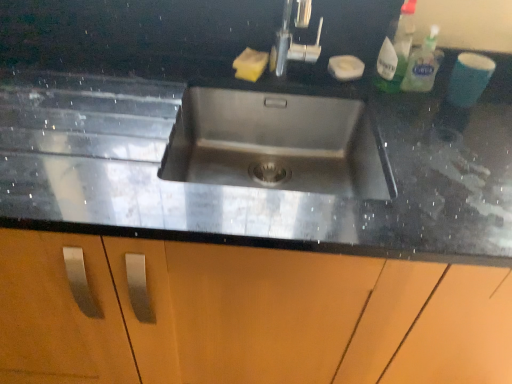
Question: Considering the relative sizes of yellow sponge at upper center, acting as the second soap starting from the right, and translucent plastic spray bottle at upper right, which appears as the 1th cleaning product when viewed from the left, in the image provided, is yellow sponge at upper center, acting as the second soap starting from the right, bigger than translucent plastic spray bottle at upper right, which appears as the 1th cleaning product when viewed from the left,?

Choices:
 (A) yes
 (B) no

Answer: (B)

Question: Is yellow sponge at upper center, acting as the second soap starting from the right, outside of translucent plastic spray bottle at upper right, which appears as the 1th cleaning product when viewed from the left?

Choices:
 (A) no
 (B) yes

Answer: (B)

Question: Can you confirm if yellow sponge at upper center, which ranks as the first soap in left-to-right order, is wider than translucent plastic spray bottle at upper right, acting as the 2th cleaning product starting from the right?

Choices:
 (A) no
 (B) yes

Answer: (B)

Question: From the image's perspective, does yellow sponge at upper center, acting as the second soap starting from the right, appear higher than translucent plastic spray bottle at upper right, which appears as the 1th cleaning product when viewed from the left?

Choices:
 (A) yes
 (B) no

Answer: (B)

Question: Is yellow sponge at upper center, which ranks as the first soap in left-to-right order, to the right of translucent plastic spray bottle at upper right, which appears as the 1th cleaning product when viewed from the left, from the viewer's perspective?

Choices:
 (A) no
 (B) yes

Answer: (A)

Question: Considering the relative sizes of yellow sponge at upper center, which ranks as the first soap in left-to-right order, and translucent plastic spray bottle at upper right, acting as the 2th cleaning product starting from the right, in the image provided, is yellow sponge at upper center, which ranks as the first soap in left-to-right order, taller than translucent plastic spray bottle at upper right, acting as the 2th cleaning product starting from the right,?

Choices:
 (A) no
 (B) yes

Answer: (A)

Question: Is clear plastic bottle at upper right, marked as the 1th cleaning product in a right-to-left arrangement, in front of translucent plastic spray bottle at upper right, acting as the 2th cleaning product starting from the right?

Choices:
 (A) no
 (B) yes

Answer: (A)

Question: From the image's perspective, is clear plastic bottle at upper right, the 2th cleaning product positioned from the left, above translucent plastic spray bottle at upper right, which appears as the 1th cleaning product when viewed from the left?

Choices:
 (A) yes
 (B) no

Answer: (B)

Question: Considering the relative positions of clear plastic bottle at upper right, the 2th cleaning product positioned from the left, and translucent plastic spray bottle at upper right, acting as the 2th cleaning product starting from the right, in the image provided, is clear plastic bottle at upper right, the 2th cleaning product positioned from the left, to the right of translucent plastic spray bottle at upper right, acting as the 2th cleaning product starting from the right, from the viewer's perspective?

Choices:
 (A) no
 (B) yes

Answer: (B)

Question: Is clear plastic bottle at upper right, marked as the 1th cleaning product in a right-to-left arrangement, completely or partially outside of translucent plastic spray bottle at upper right, which appears as the 1th cleaning product when viewed from the left?

Choices:
 (A) no
 (B) yes

Answer: (B)

Question: Does clear plastic bottle at upper right, marked as the 1th cleaning product in a right-to-left arrangement, come behind translucent plastic spray bottle at upper right, acting as the 2th cleaning product starting from the right?

Choices:
 (A) no
 (B) yes

Answer: (B)

Question: Is clear plastic bottle at upper right, marked as the 1th cleaning product in a right-to-left arrangement, with translucent plastic spray bottle at upper right, acting as the 2th cleaning product starting from the right?

Choices:
 (A) no
 (B) yes

Answer: (B)

Question: Does black granite sink at center have a smaller size compared to white matte soap at upper right, which is the 2th soap from left to right?

Choices:
 (A) no
 (B) yes

Answer: (A)